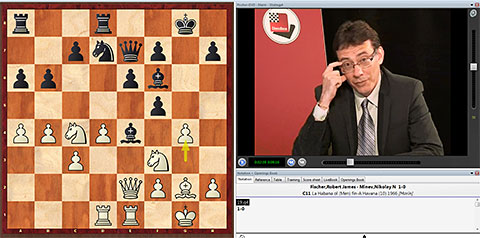
This screenshot has height=238, width=480. Identify the location of board chess. (49, 206).